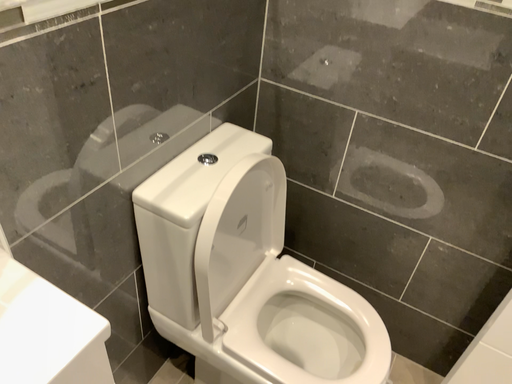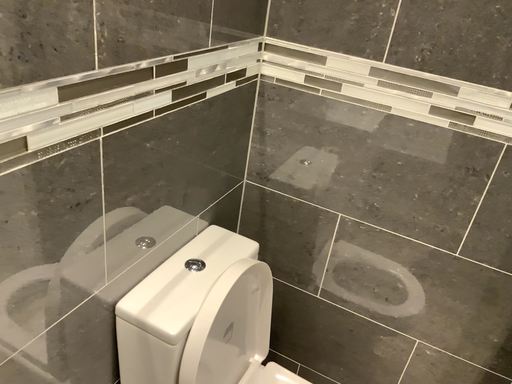
Question: Which way did the camera rotate in the video?

Choices:
 (A) rotated downward
 (B) rotated upward

Answer: (B)